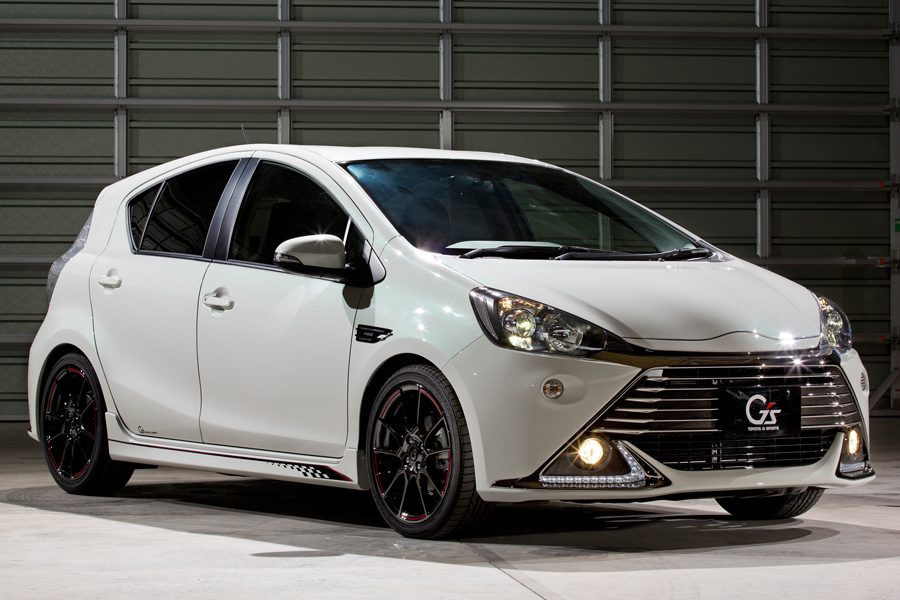
The height and width of the screenshot is (600, 900). I want to click on front door handle on right side, so click(218, 301).